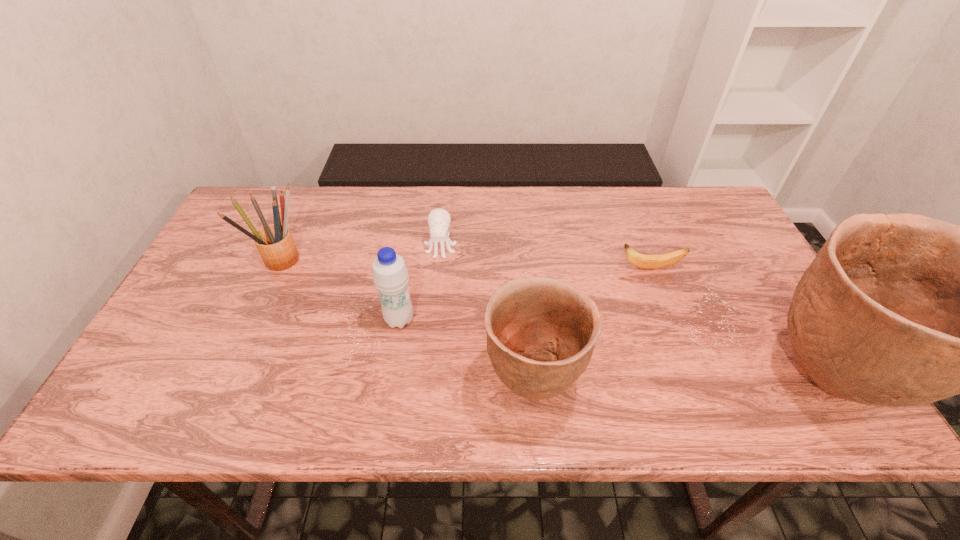
Given the evenly spaced potterys in the image, where should an extra pottery be added on the left to preserve the spacing? Please point to a vacant space. Please provide its 2D coordinates. Your answer should be formatted as a tuple, i.e. [(x, y)], where the tuple contains the x and y coordinates of a point satisfying the conditions above.

[(233, 384)]